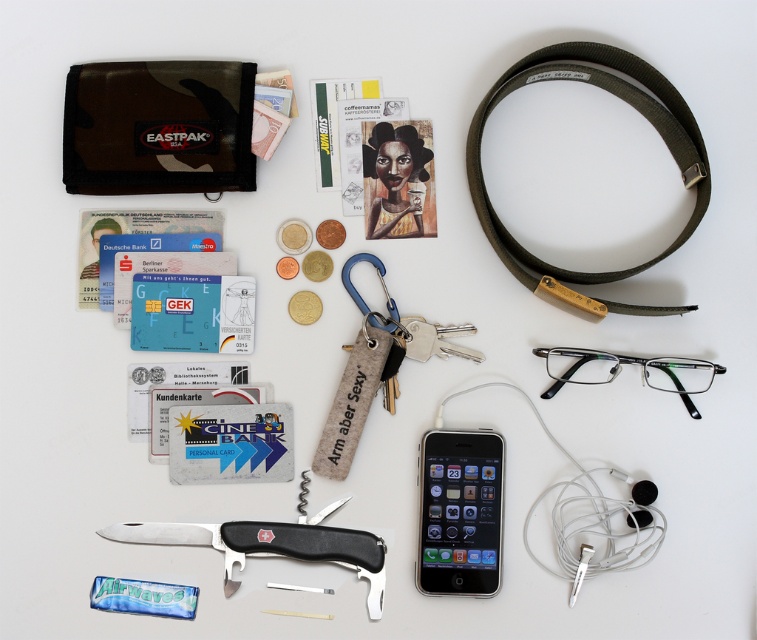
You are holding a silver metallic smartphone at center and want to place it on top of the black plastic pocket knife at center. Is this possible given their positions?

The silver metallic smartphone at center is closer to the viewer than the black plastic pocket knife at center, so placing the smartphone on top would not be possible since it is in front and not above.

You are organizing items on a table and need to place the olive green fabric strap at upper right and the matte black glasses at lower right. According to their positions in the image, which object is closer to the right edge of the table?

The matte black glasses at lower right are closer to the right edge of the table since the olive green fabric strap at upper right is positioned to the left of them.